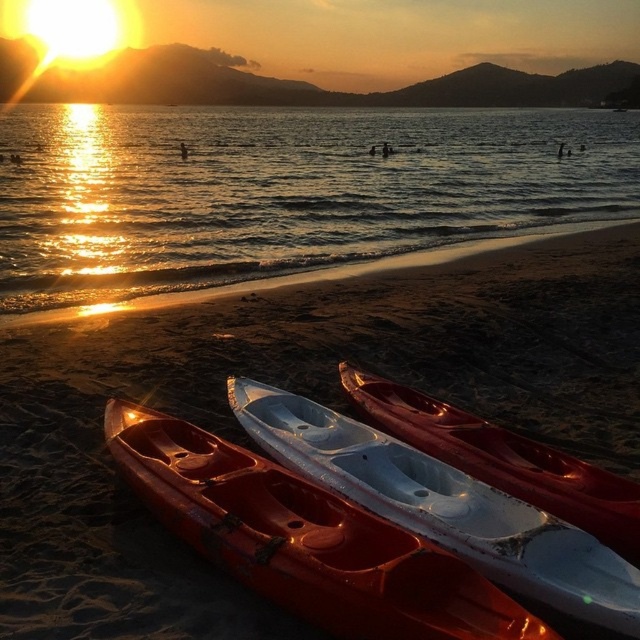
Question: Among these objects, which one is farthest from the camera?

Choices:
 (A) matte orange canoe at lower left
 (B) white glossy canoe at center

Answer: (B)

Question: Among these objects, which one is nearest to the camera?

Choices:
 (A) shiny golden water at lower left
 (B) white glossy canoe at center

Answer: (B)

Question: Is shiny golden water at lower left further to camera compared to white glossy canoe at center?

Choices:
 (A) yes
 (B) no

Answer: (A)

Question: Does shiny golden water at lower left have a greater width compared to white glossy canoe at center?

Choices:
 (A) no
 (B) yes

Answer: (B)

Question: Is smooth sand at lower center to the left of white glossy canoe at center from the viewer's perspective?

Choices:
 (A) no
 (B) yes

Answer: (B)

Question: Which point is closer to the camera?

Choices:
 (A) (61, 234)
 (B) (268, 339)
 (C) (275, 576)
 (D) (419, 397)

Answer: (C)